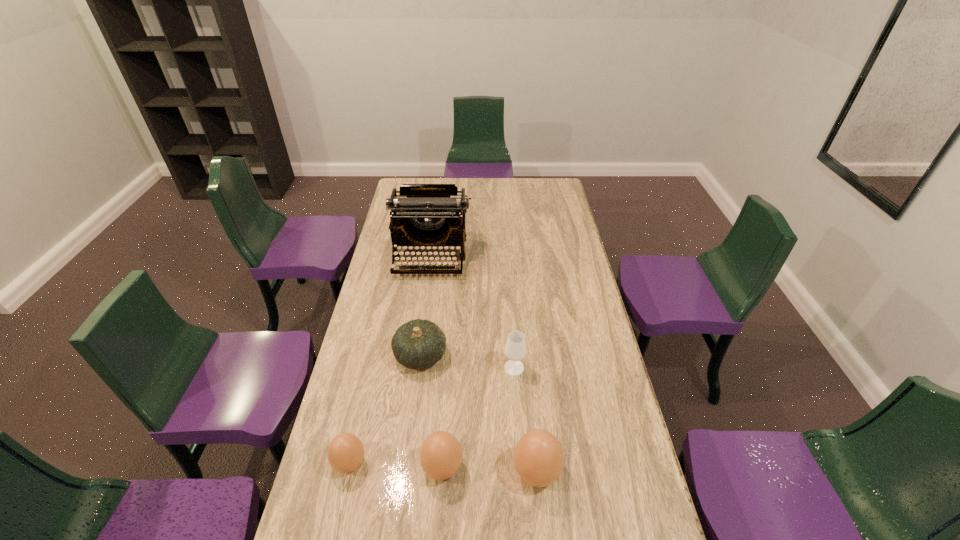
Please point a spot on the right to add another boiled egg. Please provide its 2D coordinates. Your answer should be formatted as a tuple, i.e. [(x, y)], where the tuple contains the x and y coordinates of a point satisfying the conditions above.

[(632, 477)]